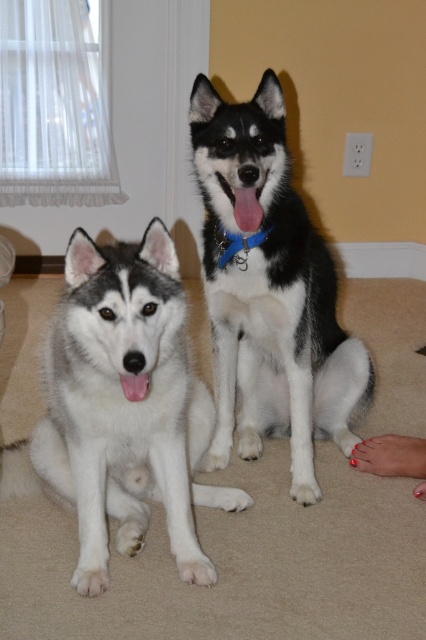
Question: Which is nearer to the black and white fur at center?

Choices:
 (A) white fluffy dog at center
 (B) blue fabric neckband at center

Answer: (B)

Question: Which object appears farthest from the camera in this image?

Choices:
 (A) blue fabric neckband at center
 (B) black and white fur at center

Answer: (A)

Question: Is black and white fur at center above blue fabric neckband at center?

Choices:
 (A) no
 (B) yes

Answer: (A)

Question: Is white fluffy dog at center to the right of black and white fur at center from the viewer's perspective?

Choices:
 (A) no
 (B) yes

Answer: (A)

Question: Does white fluffy dog at center have a smaller size compared to blue fabric neckband at center?

Choices:
 (A) no
 (B) yes

Answer: (A)

Question: Which point appears farthest from the camera in this image?

Choices:
 (A) (160, 490)
 (B) (238, 266)
 (C) (219, 376)

Answer: (C)